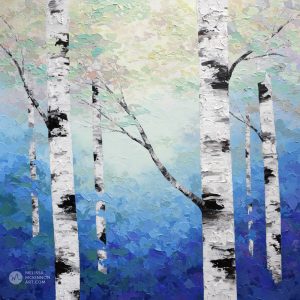
You are a GUI agent. You are given a task and a screenshot of the screen. Output one action in this format:
    pyautogui.click(x=<x>, y=<y>)
    Task: Click on the painting
    The height and width of the screenshot is (300, 300).
    Given the screenshot: What is the action you would take?
    pyautogui.click(x=141, y=222)